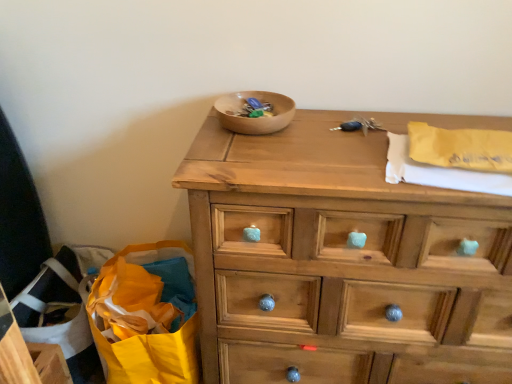
Find the location of a particular element. This screenshot has height=384, width=512. unoccupied area behind yellow paper at upper right is located at coordinates (429, 117).